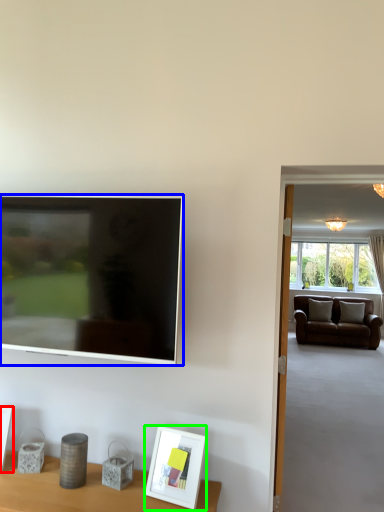
Question: Considering the real-world distances, which object is closest to picture frame (highlighted by a red box)? television (highlighted by a blue box) or picture frame (highlighted by a green box).

Choices:
 (A) television
 (B) picture frame

Answer: (A)